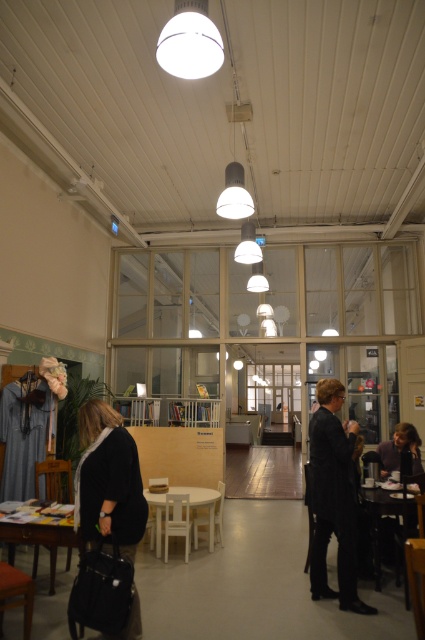
Question: Which object is positioned farthest from the wooden table at lower left?

Choices:
 (A) black glossy table at lower right
 (B) white matte table at center

Answer: (A)

Question: Which object is the farthest from the black glossy table at lower right?

Choices:
 (A) velvet black coat at lower left
 (B) white matte table at center
 (C) wooden table at lower left
 (D) black pinstripe suit at right

Answer: (C)

Question: Estimate the real-world distances between objects in this image. Which object is farther from the white matte table at center?

Choices:
 (A) wooden table at lower left
 (B) black glossy table at lower right
 (C) velvet black coat at lower left

Answer: (C)

Question: In this image, where is black pinstripe suit at right located relative to white matte table at center?

Choices:
 (A) left
 (B) right

Answer: (B)

Question: Is the position of wooden table at lower left more distant than that of black glossy table at lower right?

Choices:
 (A) no
 (B) yes

Answer: (A)

Question: Is velvet black coat at lower left to the right of black pinstripe suit at right from the viewer's perspective?

Choices:
 (A) yes
 (B) no

Answer: (B)